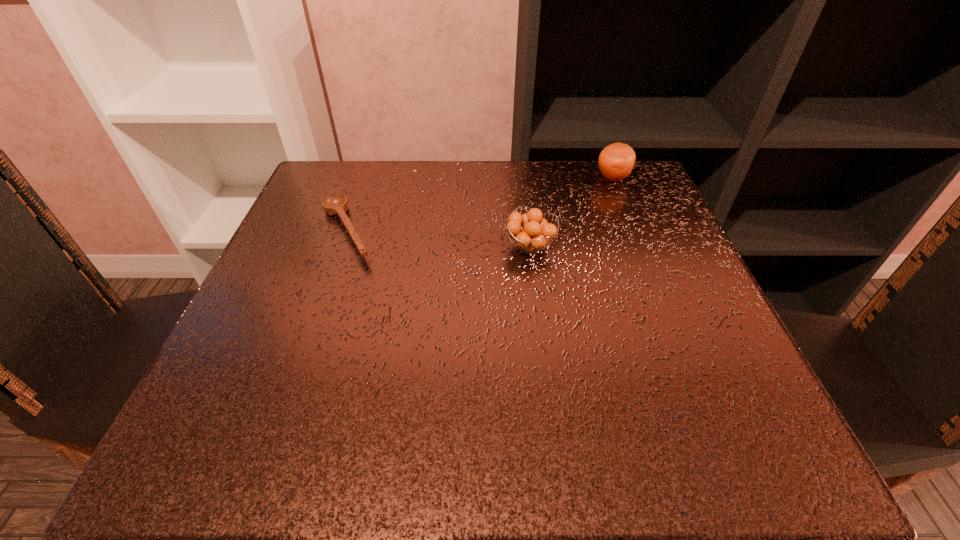
Identify the location of free spot between the shorter orange fruit and the shortest object. (439, 239).

You are a GUI agent. You are given a task and a screenshot of the screen. Output one action in this format:
    pyautogui.click(x=<x>, y=<y>)
    Task: Click on the empty location between the second object from right to left and the shortest object
    The width and height of the screenshot is (960, 540).
    Given the screenshot: What is the action you would take?
    pyautogui.click(x=439, y=239)

Identify the location of object that is the second closest to the wooden spoon. Image resolution: width=960 pixels, height=540 pixels. (616, 161).

Select which object is the closest to the second object from left to right. Please provide its 2D coordinates. Your answer should be formatted as a tuple, i.e. [(x, y)], where the tuple contains the x and y coordinates of a point satisfying the conditions above.

[(616, 161)]